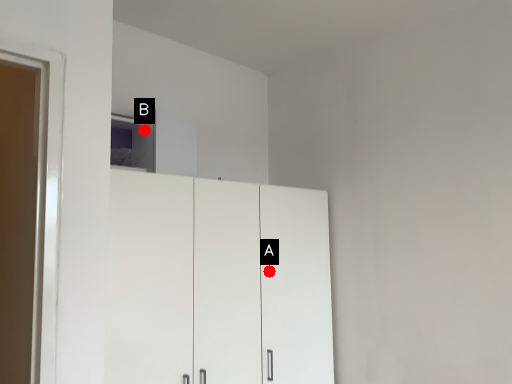
Question: Two points are circled on the image, labeled by A and B beside each circle. Which point is closer to the camera?

Choices:
 (A) A is closer
 (B) B is closer

Answer: (B)